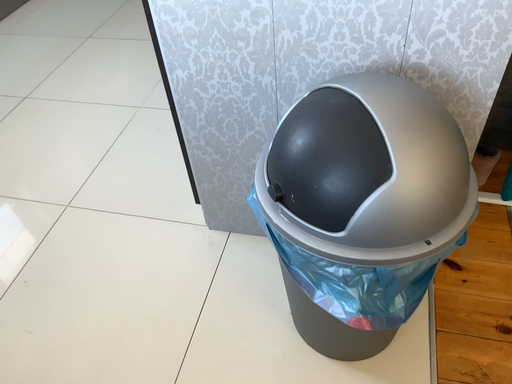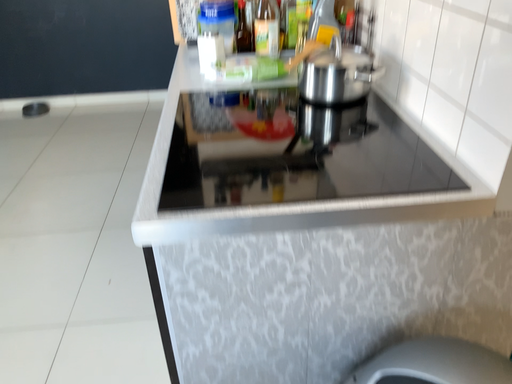
Question: How did the camera likely rotate when shooting the video?

Choices:
 (A) rotated upward
 (B) rotated downward

Answer: (A)